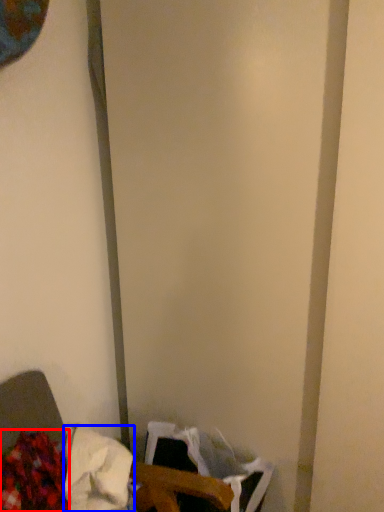
Question: Which object is closer to the camera taking this photo, waste (highlighted by a red box) or waste (highlighted by a blue box)?

Choices:
 (A) waste
 (B) waste

Answer: (A)